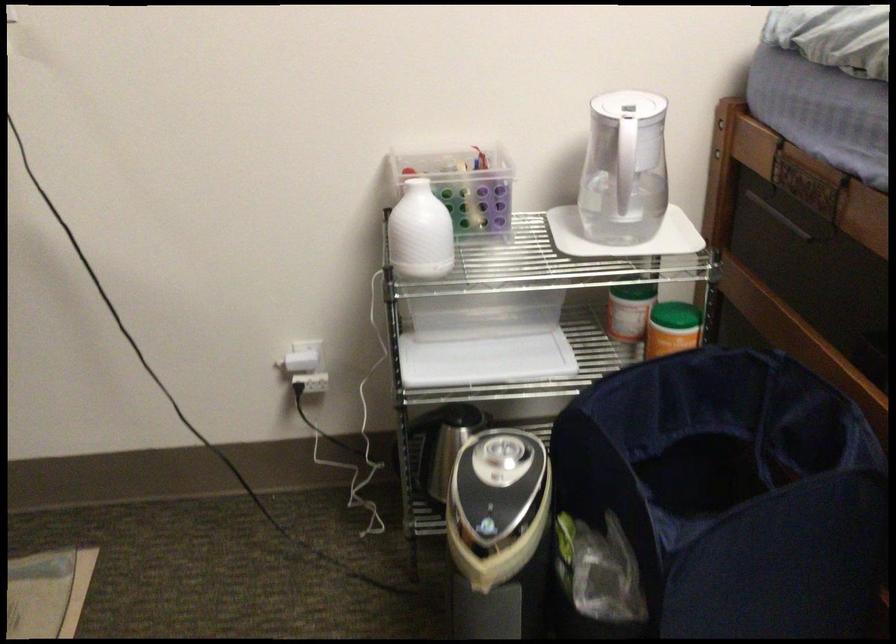
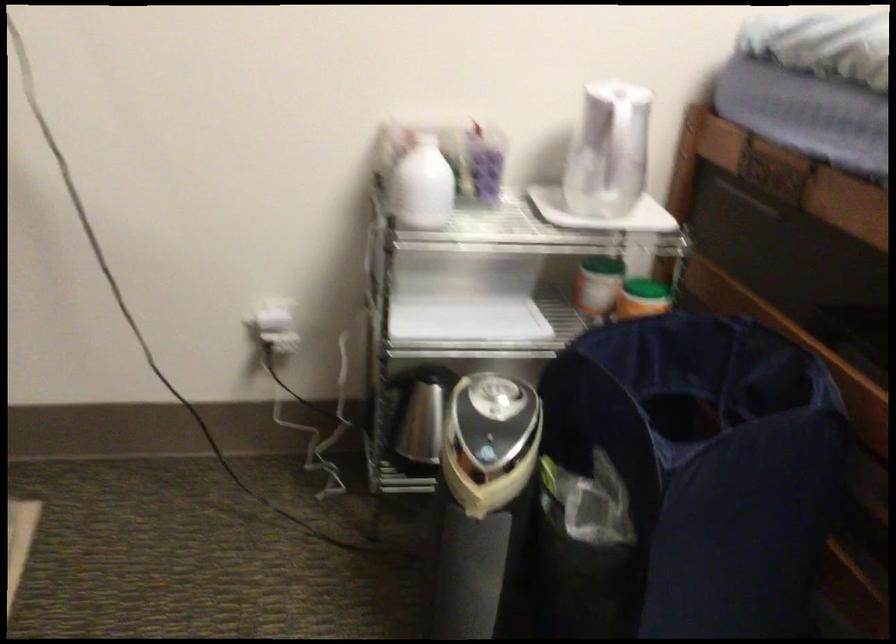
Question: How did the camera likely rotate?

Choices:
 (A) Left
 (B) Right
 (C) Up
 (D) Down

Answer: (B)